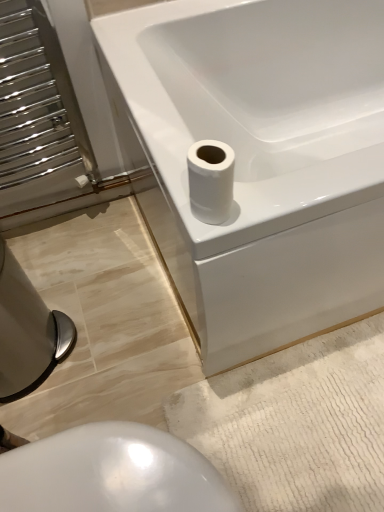
What do you see at coordinates (111, 473) in the screenshot? The height and width of the screenshot is (512, 384). I see `white glossy bidet at lower center, which is counted as the 2th bidet, starting from the left` at bounding box center [111, 473].

In order to face white glossy bidet at lower center, which is the first bidet from right to left, should I rotate leftwards or rightwards?

Rotate your view left by about 11.449°.

What is the approximate width of brushed metal bidet at lower left, which ranks as the first bidet in left-to-right order?

8.67 inches.

Locate an element on the screen. Image resolution: width=384 pixels, height=512 pixels. white glossy toilet paper at upper right is located at coordinates (211, 180).

Which of these two, brushed metal bidet at lower left, which ranks as the first bidet in left-to-right order, or white glossy bathtub at upper right, is smaller?

brushed metal bidet at lower left, which ranks as the first bidet in left-to-right order.

Is brushed metal bidet at lower left, the second bidet positioned from the right, in front of or behind white glossy bathtub at upper right in the image?

In the image, brushed metal bidet at lower left, the second bidet positioned from the right, appears behind white glossy bathtub at upper right.

From a real-world perspective, who is located lower, brushed metal bidet at lower left, which ranks as the first bidet in left-to-right order, or white glossy bathtub at upper right?

brushed metal bidet at lower left, which ranks as the first bidet in left-to-right order, from a real-world perspective.

Is brushed metal bidet at lower left, the second bidet positioned from the right, oriented away from white glossy bathtub at upper right?

No.

Does white glossy toilet paper at upper right turn towards white glossy bidet at lower center, which is counted as the 2th bidet, starting from the left?

No, white glossy toilet paper at upper right is not turned towards white glossy bidet at lower center, which is counted as the 2th bidet, starting from the left.

Is white glossy bidet at lower center, which is counted as the 2th bidet, starting from the left, a part of white glossy toilet paper at upper right?

No, white glossy bidet at lower center, which is counted as the 2th bidet, starting from the left, is not surrounded by white glossy toilet paper at upper right.

Is white glossy toilet paper at upper right wider or thinner than white glossy bidet at lower center, which is the first bidet from right to left?

In the image, white glossy toilet paper at upper right appears to be more narrow than white glossy bidet at lower center, which is the first bidet from right to left.

Is brushed metal bidet at lower left, which ranks as the first bidet in left-to-right order, surrounded by white glossy toilet paper at upper right?

No, white glossy toilet paper at upper right does not contain brushed metal bidet at lower left, which ranks as the first bidet in left-to-right order.

From a real-world perspective, between white glossy toilet paper at upper right and brushed metal bidet at lower left, the second bidet positioned from the right, who is vertically lower?

brushed metal bidet at lower left, the second bidet positioned from the right.

Measure the distance from white glossy toilet paper at upper right to brushed metal bidet at lower left, the second bidet positioned from the right.

white glossy toilet paper at upper right is 27.78 inches away from brushed metal bidet at lower left, the second bidet positioned from the right.

Considering the relative positions of white glossy toilet paper at upper right and brushed metal bidet at lower left, the second bidet positioned from the right, in the image provided, is white glossy toilet paper at upper right behind brushed metal bidet at lower left, the second bidet positioned from the right,?

No, it is in front of brushed metal bidet at lower left, the second bidet positioned from the right.

From a real-world perspective, is white glossy toilet paper at upper right physically located above or below white glossy bathtub at upper right?

white glossy toilet paper at upper right is situated higher than white glossy bathtub at upper right in the real world.

Where is `toilet paper above the white glossy bathtub at upper right (from a real-world perspective)`? toilet paper above the white glossy bathtub at upper right (from a real-world perspective) is located at coordinates (211, 180).

Is there a large distance between white glossy toilet paper at upper right and white glossy bathtub at upper right?

white glossy toilet paper at upper right is near white glossy bathtub at upper right, not far away.

Would you consider white glossy bidet at lower center, which is counted as the 2th bidet, starting from the left, to be distant from white glossy toilet paper at upper right?

No.

In terms of height, does white glossy bidet at lower center, which is the first bidet from right to left, look taller or shorter compared to white glossy toilet paper at upper right?

Considering their sizes, white glossy bidet at lower center, which is the first bidet from right to left, has more height than white glossy toilet paper at upper right.

Which is more to the right, white glossy bidet at lower center, which is the first bidet from right to left, or white glossy toilet paper at upper right?

Positioned to the right is white glossy toilet paper at upper right.

Which is correct: white glossy bidet at lower center, which is counted as the 2th bidet, starting from the left, is inside white glossy toilet paper at upper right, or outside of it?

The correct answer is: outside.

Which is in front, point (356, 259) or point (128, 482)?

Positioned in front is point (128, 482).

Is white glossy bathtub at upper right not near white glossy bidet at lower center, which is counted as the 2th bidet, starting from the left?

Actually, white glossy bathtub at upper right and white glossy bidet at lower center, which is counted as the 2th bidet, starting from the left, are a little close together.

Consider the image. Which of these two, white glossy bathtub at upper right or white glossy bidet at lower center, which is the first bidet from right to left, is thinner?

Thinner between the two is white glossy bidet at lower center, which is the first bidet from right to left.

Which of these two, white glossy bathtub at upper right or white glossy bidet at lower center, which is the first bidet from right to left, stands taller?

white glossy bathtub at upper right is taller.

Considering the relative sizes of white glossy bathtub at upper right and brushed metal bidet at lower left, the second bidet positioned from the right, in the image provided, is white glossy bathtub at upper right thinner than brushed metal bidet at lower left, the second bidet positioned from the right,?

In fact, white glossy bathtub at upper right might be wider than brushed metal bidet at lower left, the second bidet positioned from the right.

In the image, is white glossy bathtub at upper right positioned in front of or behind brushed metal bidet at lower left, which ranks as the first bidet in left-to-right order?

Visually, white glossy bathtub at upper right is located in front of brushed metal bidet at lower left, which ranks as the first bidet in left-to-right order.

Can you confirm if white glossy bathtub at upper right is positioned to the right of brushed metal bidet at lower left, which ranks as the first bidet in left-to-right order?

Yes.

In the image, there is a white glossy bathtub at upper right. What are the coordinates of `bidet below it (from a real-world perspective)` in the screenshot? It's located at (27, 332).

Where is `toilet paper above the white glossy bidet at lower center, which is the first bidet from right to left (from the image's perspective)`? toilet paper above the white glossy bidet at lower center, which is the first bidet from right to left (from the image's perspective) is located at coordinates pos(211,180).

Estimate the real-world distances between objects in this image. Which object is closer to white glossy bidet at lower center, which is the first bidet from right to left, white glossy toilet paper at upper right or brushed metal bidet at lower left, which ranks as the first bidet in left-to-right order?

Among the two, white glossy toilet paper at upper right is located nearer to white glossy bidet at lower center, which is the first bidet from right to left.

Looking at the image, which one is located closer to brushed metal bidet at lower left, which ranks as the first bidet in left-to-right order, white glossy toilet paper at upper right or white glossy bidet at lower center, which is counted as the 2th bidet, starting from the left?

white glossy bidet at lower center, which is counted as the 2th bidet, starting from the left, is positioned closer to the anchor brushed metal bidet at lower left, which ranks as the first bidet in left-to-right order.

When comparing their distances from white glossy toilet paper at upper right, does white glossy bidet at lower center, which is the first bidet from right to left, or brushed metal bidet at lower left, which ranks as the first bidet in left-to-right order, seem further?

Based on the image, brushed metal bidet at lower left, which ranks as the first bidet in left-to-right order, appears to be further to white glossy toilet paper at upper right.

Looking at the image, which one is located closer to white glossy toilet paper at upper right, brushed metal bidet at lower left, the second bidet positioned from the right, or white glossy bathtub at upper right?

white glossy bathtub at upper right.

In the scene shown: Based on their spatial positions, is white glossy toilet paper at upper right or white glossy bidet at lower center, which is the first bidet from right to left, closer to white glossy bathtub at upper right?

Based on the image, white glossy toilet paper at upper right appears to be nearer to white glossy bathtub at upper right.

From the picture: When comparing their distances from white glossy bidet at lower center, which is the first bidet from right to left, does brushed metal bidet at lower left, the second bidet positioned from the right, or white glossy bathtub at upper right seem further?

The object further to white glossy bidet at lower center, which is the first bidet from right to left, is white glossy bathtub at upper right.

Considering their positions, is white glossy bidet at lower center, which is the first bidet from right to left, positioned further to white glossy bathtub at upper right than white glossy toilet paper at upper right?

Based on the image, white glossy bidet at lower center, which is the first bidet from right to left, appears to be further to white glossy bathtub at upper right.

When comparing their distances from white glossy bathtub at upper right, does white glossy toilet paper at upper right or brushed metal bidet at lower left, the second bidet positioned from the right, seem further?

brushed metal bidet at lower left, the second bidet positioned from the right, lies further to white glossy bathtub at upper right than the other object.

Locate an element on the screen. This screenshot has width=384, height=512. bidet between brushed metal bidet at lower left, the second bidet positioned from the right, and white glossy bathtub at upper right, in the horizontal direction is located at coordinates (111, 473).

The image size is (384, 512). Identify the location of toilet paper between brushed metal bidet at lower left, which ranks as the first bidet in left-to-right order, and white glossy bathtub at upper right from left to right. (211, 180).

Find the location of a particular element. This screenshot has width=384, height=512. toilet paper between white glossy bathtub at upper right and white glossy bidet at lower center, which is the first bidet from right to left, in the up-down direction is located at coordinates (211, 180).

This screenshot has height=512, width=384. What are the coordinates of `bidet that lies between white glossy toilet paper at upper right and white glossy bidet at lower center, which is counted as the 2th bidet, starting from the left, from top to bottom` in the screenshot? It's located at (27, 332).